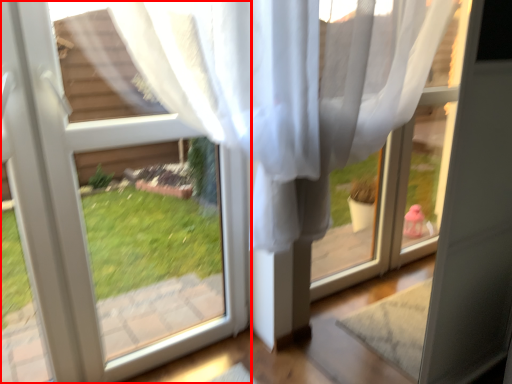
Question: From the image's perspective, considering the relative positions of window (annotated by the red box) and window frame in the image provided, where is window (annotated by the red box) located with respect to the staircase?

Choices:
 (A) below
 (B) above

Answer: (B)